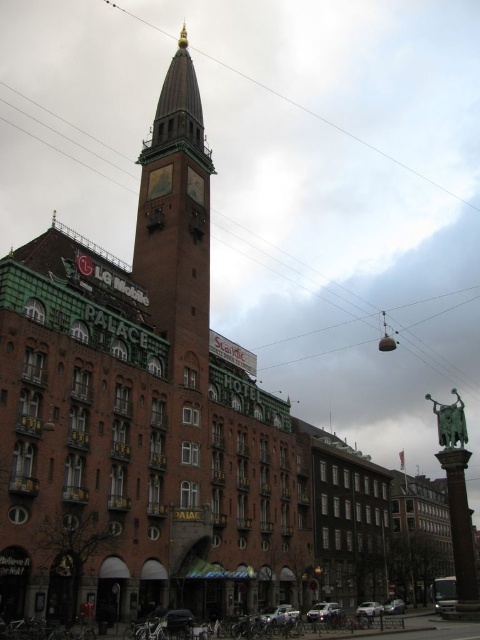
Question: Does brick steeple at center have a lesser width compared to gold metallic clock at upper center?

Choices:
 (A) yes
 (B) no

Answer: (B)

Question: From the image, what is the correct spatial relationship of brick steeple at center in relation to gold metallic clock at upper center?

Choices:
 (A) above
 (B) below

Answer: (A)

Question: Which is nearer to the gold metallic clock at upper center?

Choices:
 (A) brown wooden power line at upper center
 (B) brick steeple at center

Answer: (B)

Question: Can you confirm if brick steeple at center is wider than gold metallic clock at upper center?

Choices:
 (A) no
 (B) yes

Answer: (B)

Question: Which point is closer to the camera taking this photo?

Choices:
 (A) (189, 176)
 (B) (143, 170)
 (C) (121, 10)
 (D) (372, 260)

Answer: (A)

Question: Which is nearer to the brown wooden pole at center?

Choices:
 (A) brick steeple at center
 (B) brown wooden power line at upper center
 (C) gold metallic clock at upper center
 (D) gold textured clock at upper center

Answer: (B)